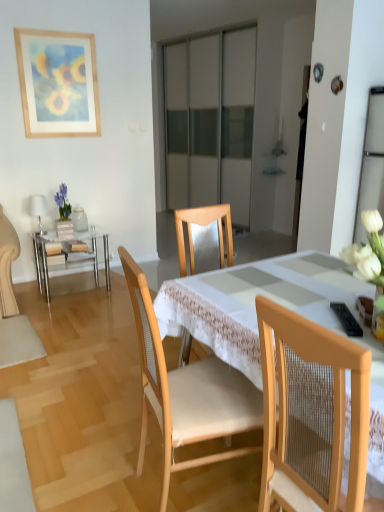
The height and width of the screenshot is (512, 384). Find the location of `vacant space behind black plastic remote control at lower right`. vacant space behind black plastic remote control at lower right is located at coordinates (334, 297).